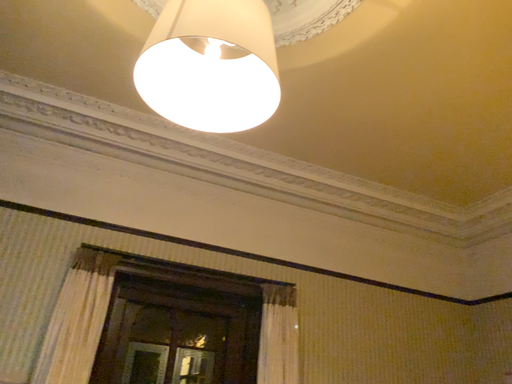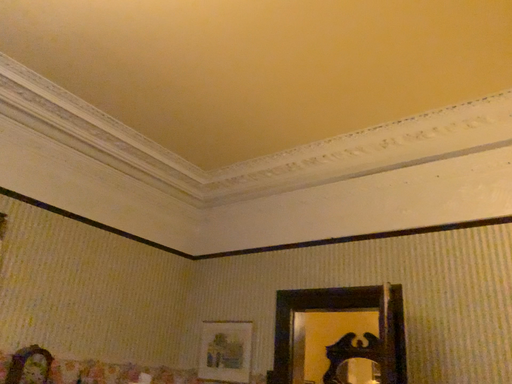
Question: How did the camera likely rotate when shooting the video?

Choices:
 (A) rotated right
 (B) rotated left

Answer: (A)